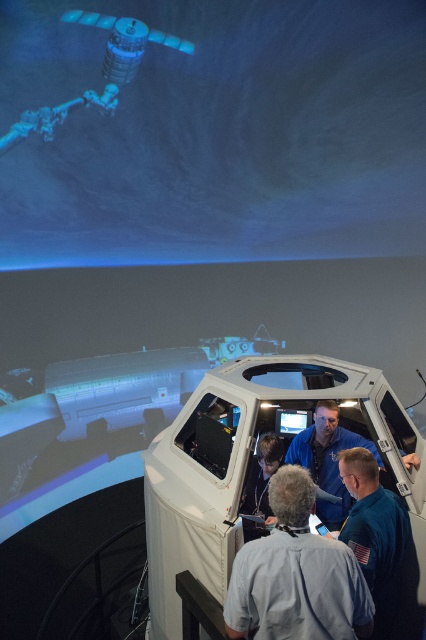
Question: Considering the real-world distances, which object is farthest from the blue fabric astronaut at lower right?

Choices:
 (A) blue fabric shirt at center
 (B) blue uniform at center
 (C) matte black monitor at center

Answer: (C)

Question: Which object is closer to the camera taking this photo?

Choices:
 (A) blue fabric astronaut at lower right
 (B) matte black monitor at center
 (C) blue uniform at center
 (D) blue fabric shirt at center

Answer: (C)

Question: Which of the following is the closest to the observer?

Choices:
 (A) blue uniform at center
 (B) blue fabric astronaut at lower right
 (C) matte black monitor at center

Answer: (A)

Question: Does blue uniform at center appear on the left side of blue fabric shirt at center?

Choices:
 (A) no
 (B) yes

Answer: (B)

Question: Can you confirm if blue uniform at center is smaller than matte black monitor at center?

Choices:
 (A) yes
 (B) no

Answer: (B)

Question: Does blue fabric shirt at center come in front of matte black monitor at center?

Choices:
 (A) yes
 (B) no

Answer: (A)